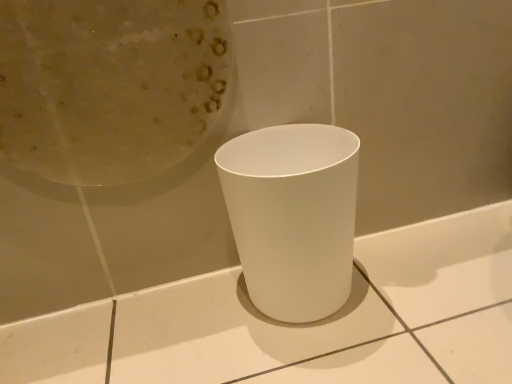
What do you see at coordinates (293, 216) in the screenshot? I see `white matte vase at center` at bounding box center [293, 216].

Locate an element on the screen. The width and height of the screenshot is (512, 384). white matte vase at center is located at coordinates (293, 216).

You are a GUI agent. You are given a task and a screenshot of the screen. Output one action in this format:
    pyautogui.click(x=<x>, y=<y>)
    Task: Click on the white matte vase at center
    
    Given the screenshot: What is the action you would take?
    pyautogui.click(x=293, y=216)